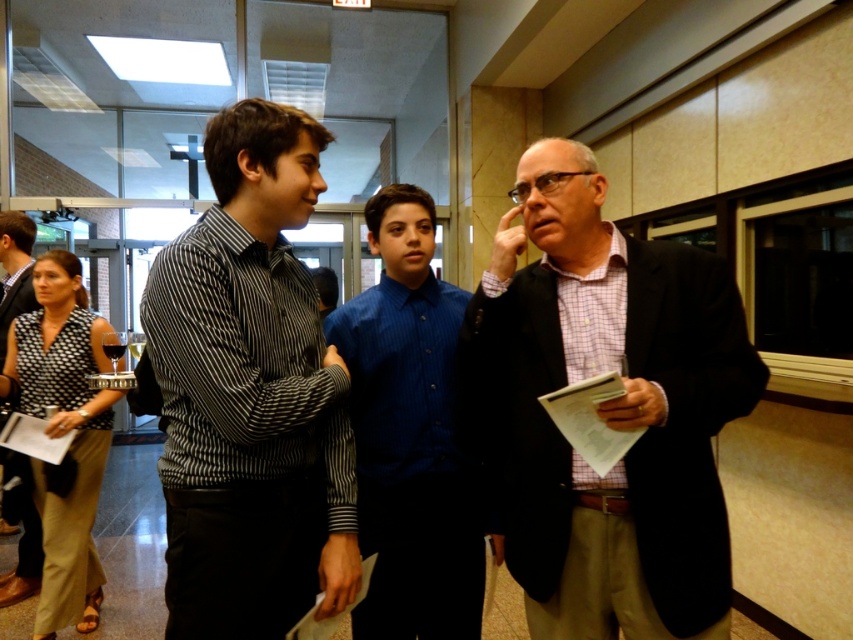
You are standing in the hallway and need to locate the plaid fabric shirt at center. According to the coordinates provided, where should you look?

You should look at the coordinates point (606, 410) to locate the plaid fabric shirt at center.